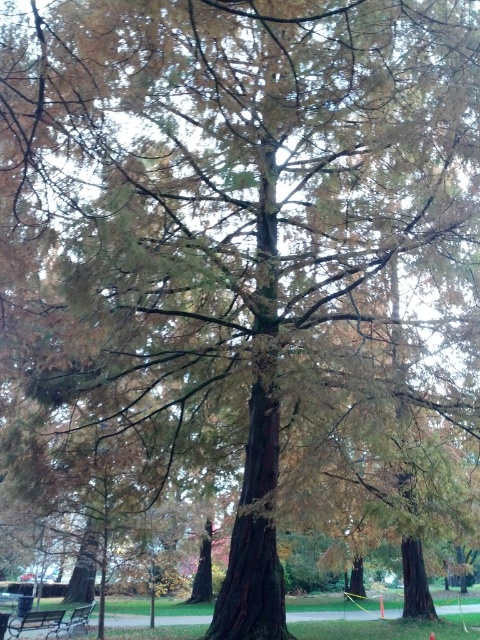
Question: Which object is the farthest from the metallic silver bench at lower left?

Choices:
 (A) wooden bench at lower left
 (B) metallic park bench at lower left

Answer: (A)

Question: Which is farther from the wooden bench at lower left?

Choices:
 (A) metallic silver bench at lower left
 (B) wooden picnic table at lower left

Answer: (B)

Question: Can you confirm if metallic park bench at lower left is positioned below wooden bench at lower left?

Choices:
 (A) yes
 (B) no

Answer: (B)

Question: Observing the image, what is the correct spatial positioning of metallic park bench at lower left in reference to wooden bench at lower left?

Choices:
 (A) left
 (B) right

Answer: (A)

Question: Among these points, which one is nearest to the camera?

Choices:
 (A) (62, 621)
 (B) (36, 620)
 (C) (8, 627)
 (D) (3, 600)

Answer: (C)

Question: Does metallic silver bench at lower left appear on the left side of wooden picnic table at lower left?

Choices:
 (A) yes
 (B) no

Answer: (B)